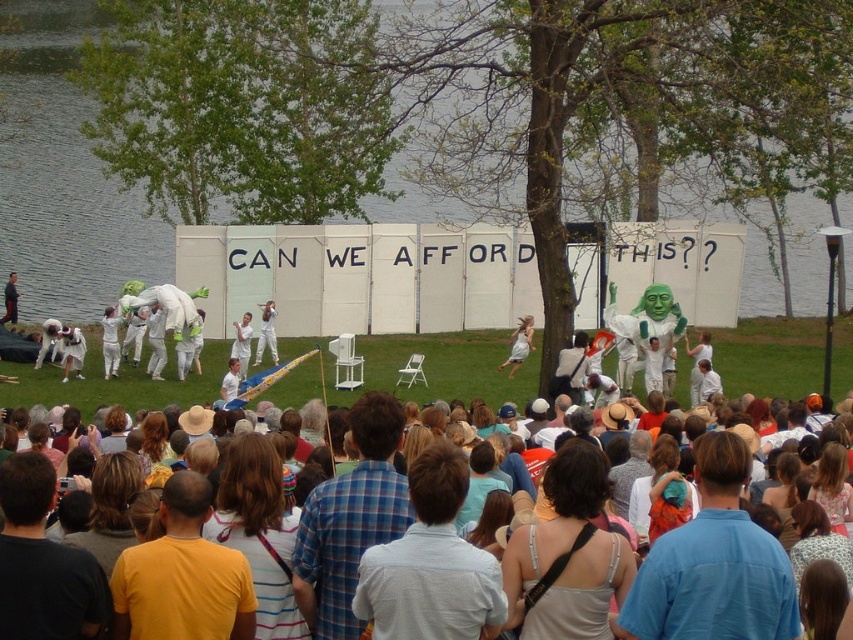
You are a photographer at the event and want to capture the performer wearing the blue cotton shirt at center without the multicolored casual clothing at center blocking the view. Is this possible given their positions?

The blue cotton shirt at center is below the multicolored casual clothing at center, so it is partially or fully obscured. Adjust your angle or position to get a clear shot of the blue cotton shirt at center without the multicolored casual clothing at center blocking it.

You are a photographer positioned at the back of the crowd. You want to take a clear photo of the performer in the blue cotton shirt at center without the multicolored casual clothing at center blocking the view. Is this possible?

The blue cotton shirt at center is in front of the multicolored casual clothing at center, so taking a clear photo of the performer in the blue cotton shirt at center without obstruction is possible since it is already positioned in front.